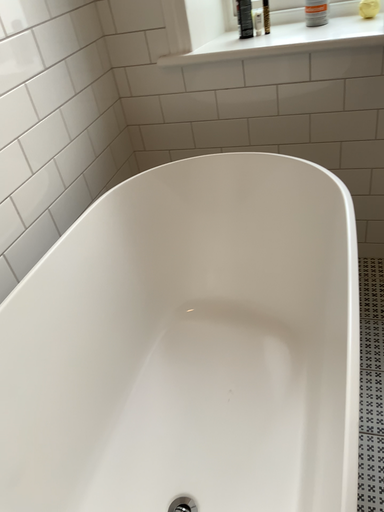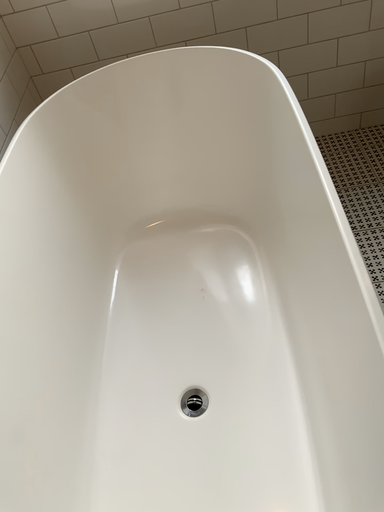
Question: How did the camera likely rotate when shooting the video?

Choices:
 (A) rotated downward
 (B) rotated upward

Answer: (A)